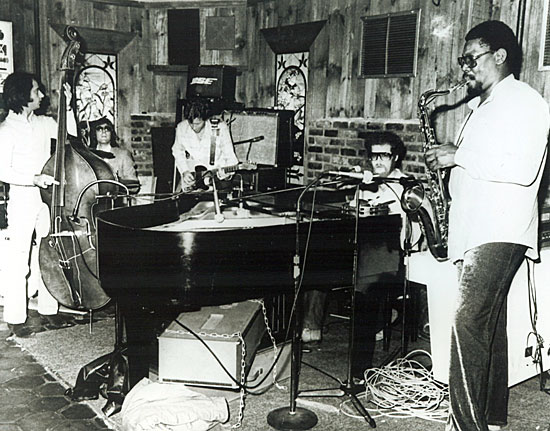
Where is `tiled floor`? The image size is (550, 431). tiled floor is located at coordinates (31, 411).